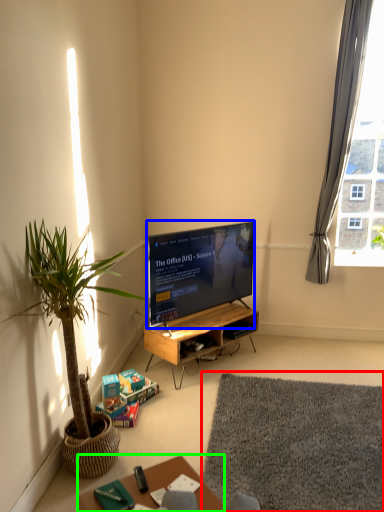
Question: Considering the real-world distances, which object is closest to mat (highlighted by a red box)? television (highlighted by a blue box) or table (highlighted by a green box).

Choices:
 (A) television
 (B) table

Answer: (B)